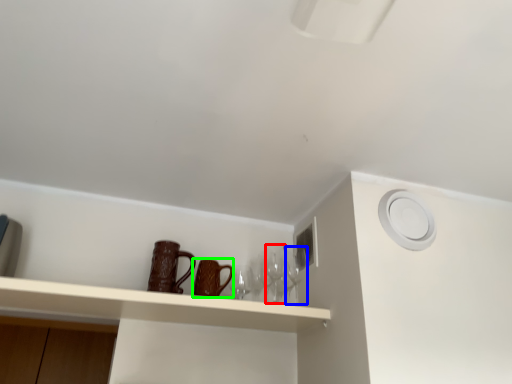
Question: Considering the real-world distances, which object is closest to wine glass (highlighted by a red box)? wine glass (highlighted by a blue box) or mug (highlighted by a green box).

Choices:
 (A) wine glass
 (B) mug

Answer: (A)